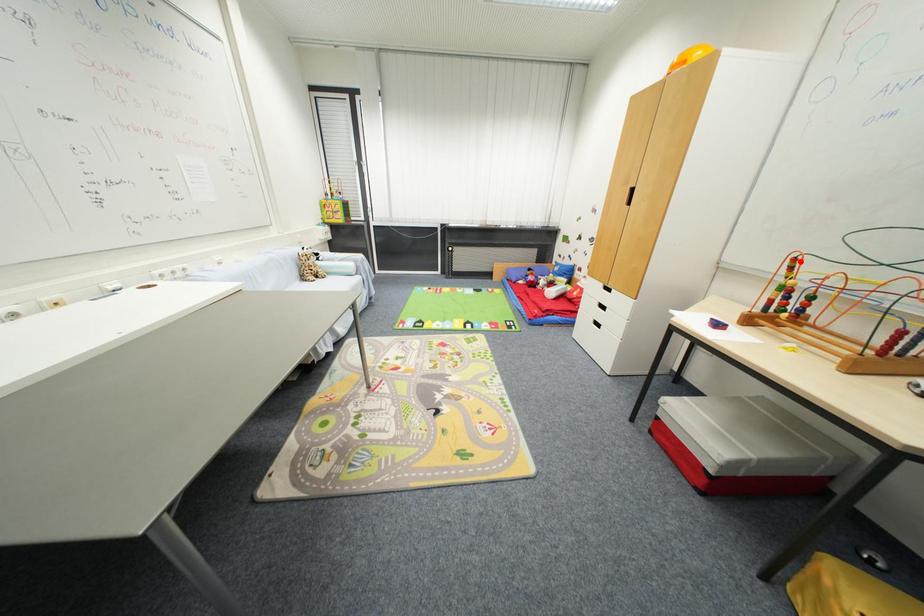
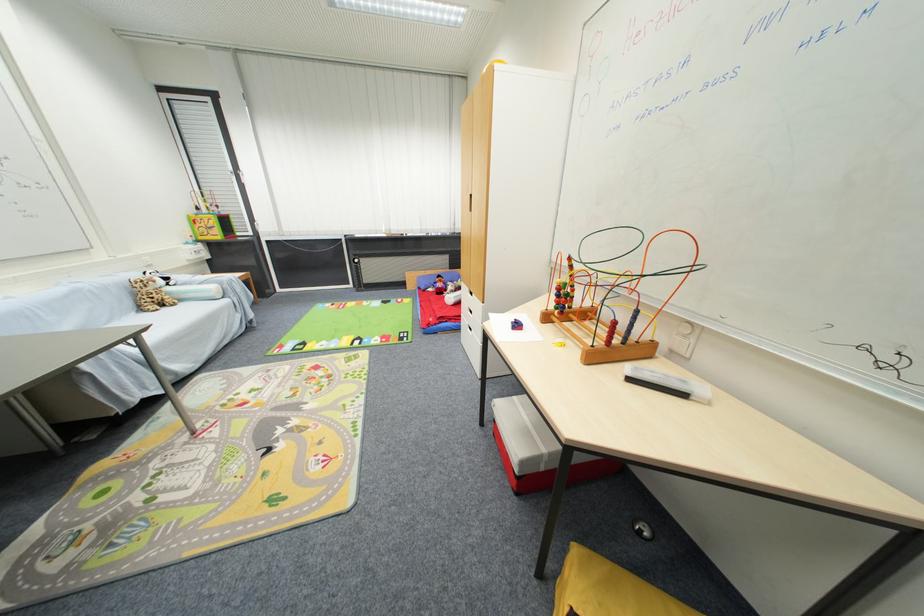
Locate, in the second image, the point that corresponds to the highlighted location in the first image.

(575, 261)